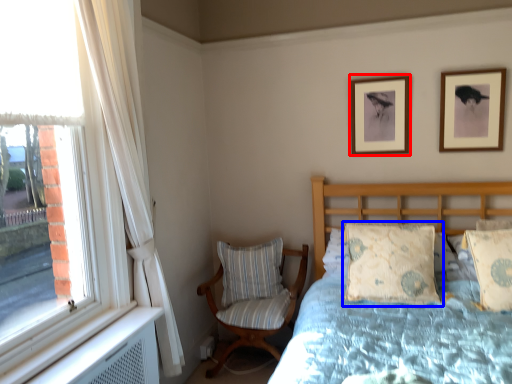
Question: Which object appears farthest to the camera in this image, picture frame (highlighted by a red box) or pillow (highlighted by a blue box)?

Choices:
 (A) picture frame
 (B) pillow

Answer: (A)